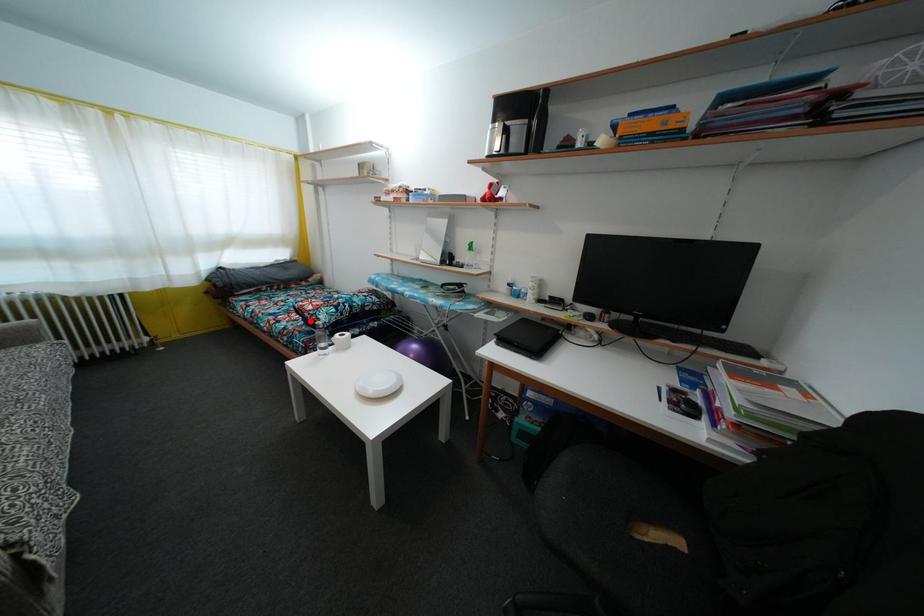
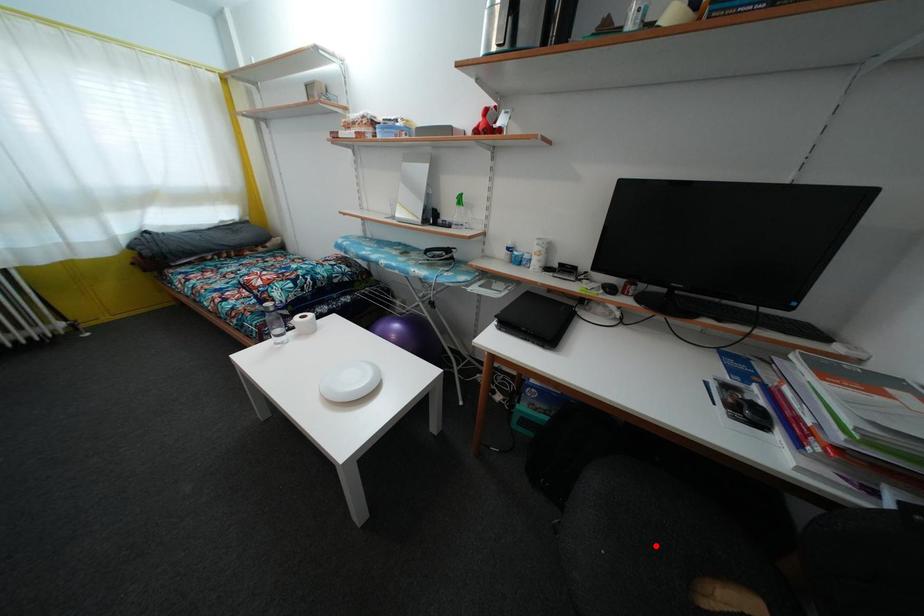
I am providing you with two images of the same scene from different viewpoints. A red point is marked on the first image and another point is marked on the second image. Does the point marked in image1 correspond to the same location as the one in image2?

No